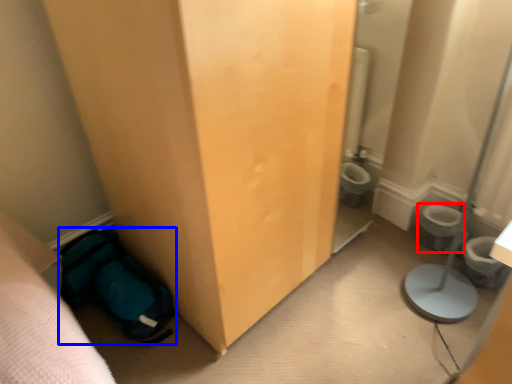
Question: Which point is closer to the camera, toilet bowl (highlighted by a red box) or sleeping bag (highlighted by a blue box)?

Choices:
 (A) toilet bowl
 (B) sleeping bag

Answer: (B)